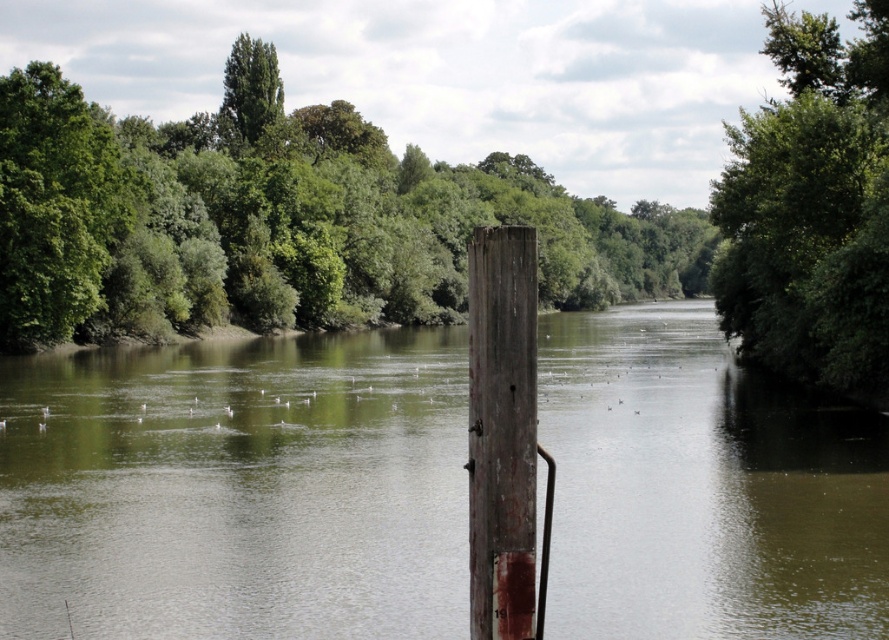
Question: Which object is closer to the camera taking this photo?

Choices:
 (A) green leafy tree at center
 (B) greenish-brown water at center
 (C) green leafy tree at upper right

Answer: (B)

Question: Which object is the farthest from the green leafy tree at center?

Choices:
 (A) greenish-brown water at center
 (B) weathered wood post at center
 (C) green leafy tree at upper right

Answer: (B)

Question: Is green leafy tree at center smaller than green leafy tree at upper right?

Choices:
 (A) no
 (B) yes

Answer: (B)

Question: From the image, what is the correct spatial relationship of greenish-brown water at center in relation to weathered wood post at center?

Choices:
 (A) right
 (B) left

Answer: (A)

Question: Which object is closer to the camera taking this photo?

Choices:
 (A) greenish-brown water at center
 (B) green leafy tree at center

Answer: (A)

Question: Is greenish-brown water at center above green leafy tree at upper right?

Choices:
 (A) yes
 (B) no

Answer: (B)